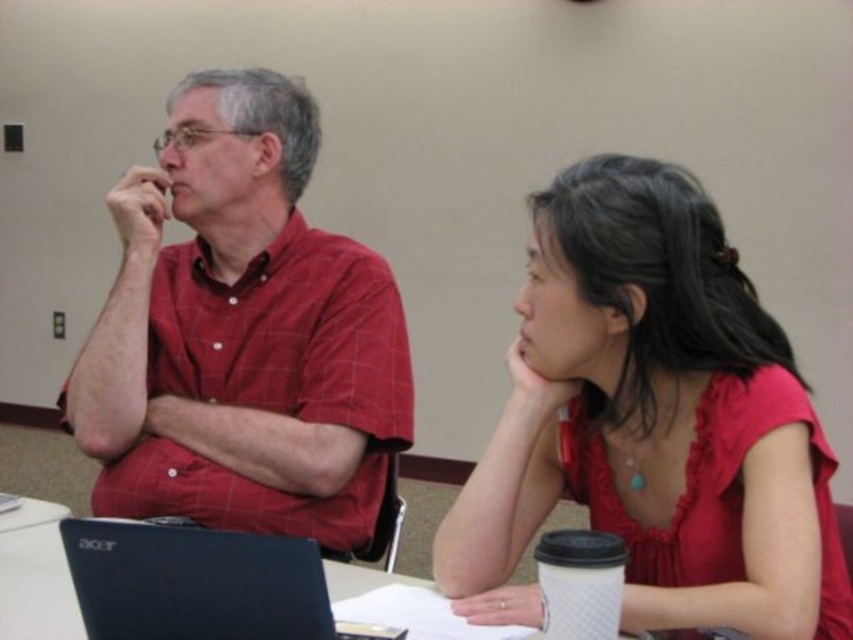
You are a fashion designer observing a meeting between two people. You notice both individuals are wearing red clothing items. The man on the left has a matte red shirt at left, and the woman on the right has a matte red blouse at center. Based on their positions, which red clothing item is positioned lower in the image?

The matte red blouse at center is positioned lower than the matte red shirt at left because it is described as being below it.

You are a person who wants to place a 12 inch ruler between the matte red blouse at center and the white paper at center without touching either. Is this possible?

The distance between the matte red blouse at center and the white paper at center is 33.26 inches. Since the ruler is only 12 inches long, it can easily be placed between them without touching either object.